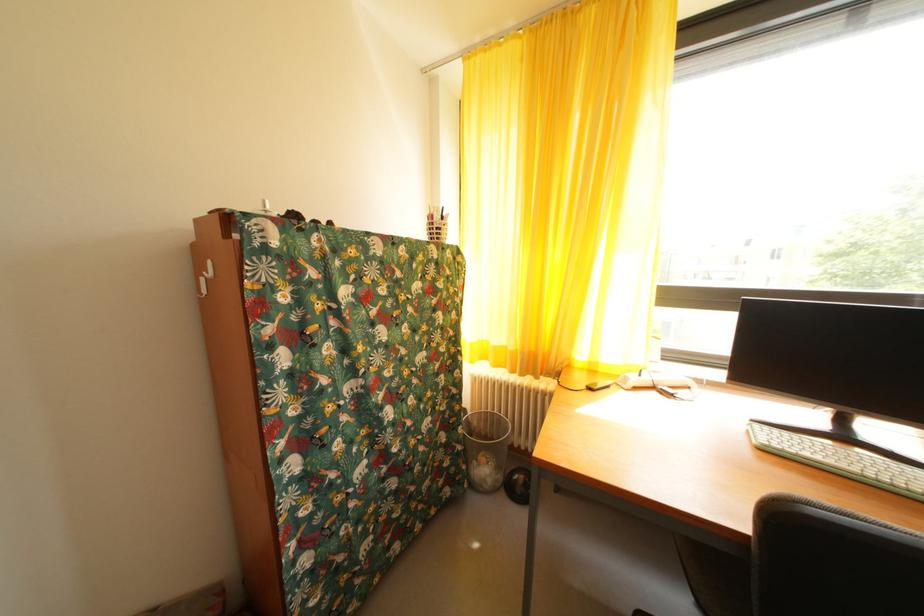
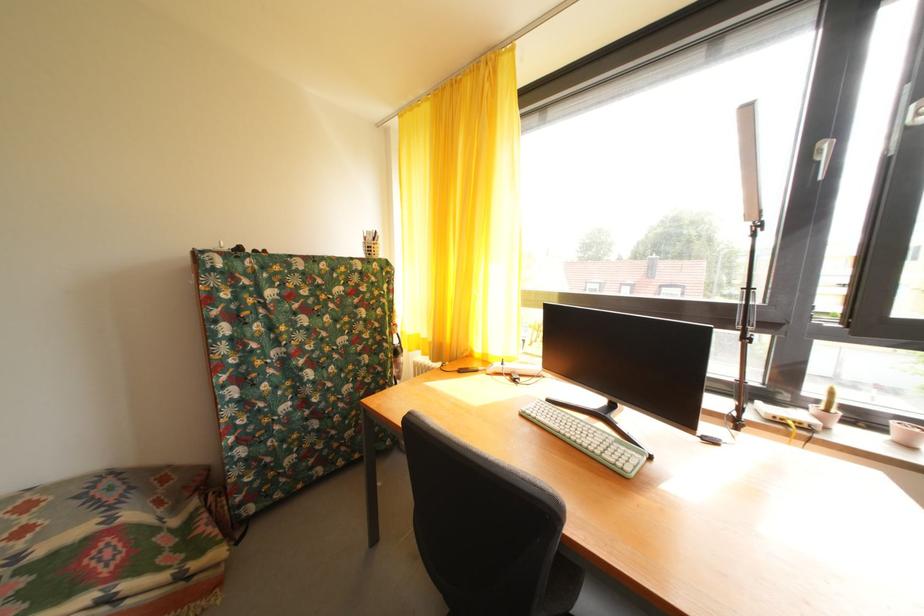
Where in the second image is the point corresponding to [505,354] from the first image?

(432, 346)